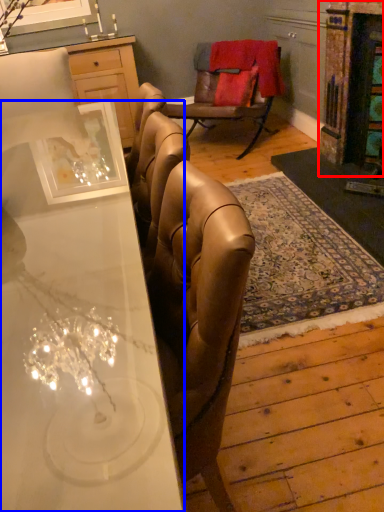
Question: Among these objects, which one is nearest to the camera, fireplace (highlighted by a red box) or desk (highlighted by a blue box)?

Choices:
 (A) fireplace
 (B) desk

Answer: (B)